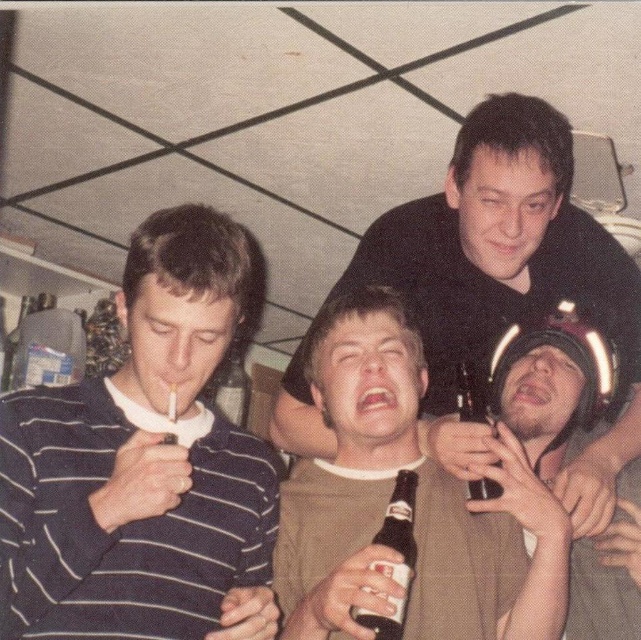
Does brown fabric shirt at center have a greater width compared to shiny metallic helmet at center?

Incorrect, brown fabric shirt at center's width does not surpass shiny metallic helmet at center's.

Is brown fabric shirt at center positioned before shiny metallic helmet at center?

Yes, brown fabric shirt at center is closer to the viewer.

Locate an element on the screen. brown fabric shirt at center is located at coordinates (417, 502).

Is dark blue striped shirt at left positioned before translucent glass beer bottle at lower right?

Yes.

Is dark blue striped shirt at left thinner than translucent glass beer bottle at lower right?

Incorrect, dark blue striped shirt at left's width is not less than translucent glass beer bottle at lower right's.

In the scene shown: Who is more forward, [237,236] or [483,496]?

Positioned in front is point [237,236].

At what (x,y) coordinates should I click in order to perform the action: click on dark blue striped shirt at left. Please return your answer as a coordinate pair (x, y). This screenshot has height=640, width=641. Looking at the image, I should click on (144, 465).

Is shiny metallic helmet at center below clear glass bottle at center?

Incorrect, shiny metallic helmet at center is not positioned below clear glass bottle at center.

Is shiny metallic helmet at center positioned in front of clear glass bottle at center?

Yes.

Where is `shiny metallic helmet at center`? shiny metallic helmet at center is located at coordinates (545, 381).